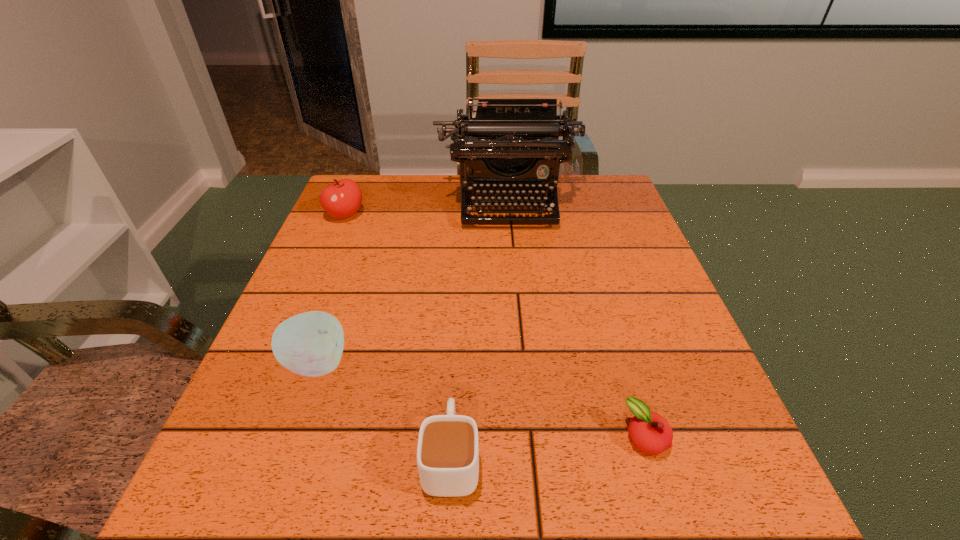
At what (x,y) coordinates should I click in order to perform the action: click on the tallest object. Please return your answer as a coordinate pair (x, y). The width and height of the screenshot is (960, 540). Looking at the image, I should click on (510, 144).

Where is `the second farthest apple`? the second farthest apple is located at coordinates (310, 344).

At what (x,y) coordinates should I click in order to perform the action: click on the farthest apple. Please return your answer as a coordinate pair (x, y). The width and height of the screenshot is (960, 540). Looking at the image, I should click on (342, 199).

What are the coordinates of `cup` in the screenshot? It's located at (448, 445).

Find the location of a particular element. The image size is (960, 540). the shortest apple is located at coordinates (651, 433).

The image size is (960, 540). Find the location of `the nearest apple`. the nearest apple is located at coordinates (651, 433).

Image resolution: width=960 pixels, height=540 pixels. I want to click on vacant space located on the keyboard of the typewriter, so click(518, 320).

Find the location of a particular element. The image size is (960, 540). free space located on the front of the third nearest object is located at coordinates (282, 464).

Locate an element on the screen. vacant space located on the front of the farthest apple is located at coordinates (323, 268).

At what (x,y) coordinates should I click in order to perform the action: click on vacant space located 0.060m on the side with the handle of the second shortest object. Please return your answer as a coordinate pair (x, y). The height and width of the screenshot is (540, 960). Looking at the image, I should click on pos(455,388).